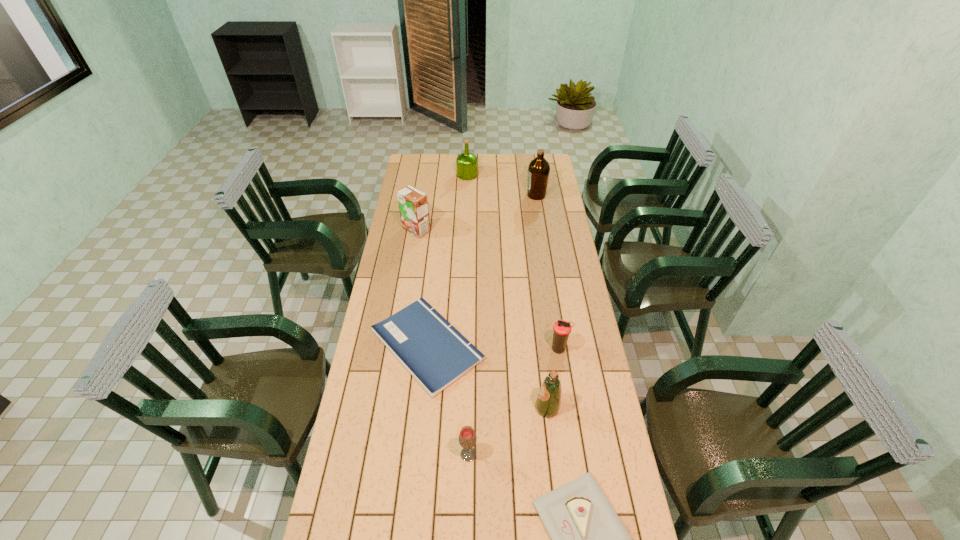
Identify the location of vacant space located 0.330m on the label of the second farthest olive oil. (466, 195).

At what (x,y) coordinates should I click in order to perform the action: click on vacant area located 0.210m on the label of the second farthest olive oil. Please return your answer as a coordinate pair (x, y). This screenshot has width=960, height=540. Looking at the image, I should click on (488, 195).

This screenshot has height=540, width=960. Find the location of `vacant space situated on the straw side of the third farthest object`. vacant space situated on the straw side of the third farthest object is located at coordinates (410, 267).

Where is `free spot located on the right of the farthest object`? The image size is (960, 540). free spot located on the right of the farthest object is located at coordinates (496, 175).

You are a GUI agent. You are given a task and a screenshot of the screen. Output one action in this format:
    pyautogui.click(x=<x>, y=<y>)
    Task: Click on the free space located 0.310m on the front-facing side of the nearest olive oil
    
    Given the screenshot: What is the action you would take?
    pyautogui.click(x=444, y=408)

The image size is (960, 540). Find the location of `blank space located on the front-facing side of the nearest olive oil`. blank space located on the front-facing side of the nearest olive oil is located at coordinates (433, 408).

Identify the location of vacant space positioned on the front-facing side of the nearest olive oil. (509, 408).

This screenshot has width=960, height=540. Find the location of `vacant area located on the front of the thermos bottle`. vacant area located on the front of the thermos bottle is located at coordinates (568, 414).

This screenshot has height=540, width=960. I want to click on vacant point located 0.400m on the back of the glass drink container, so click(x=470, y=345).

Identify the location of vacant space located 0.130m on the right of the paperback book. Image resolution: width=960 pixels, height=540 pixels. tap(518, 345).